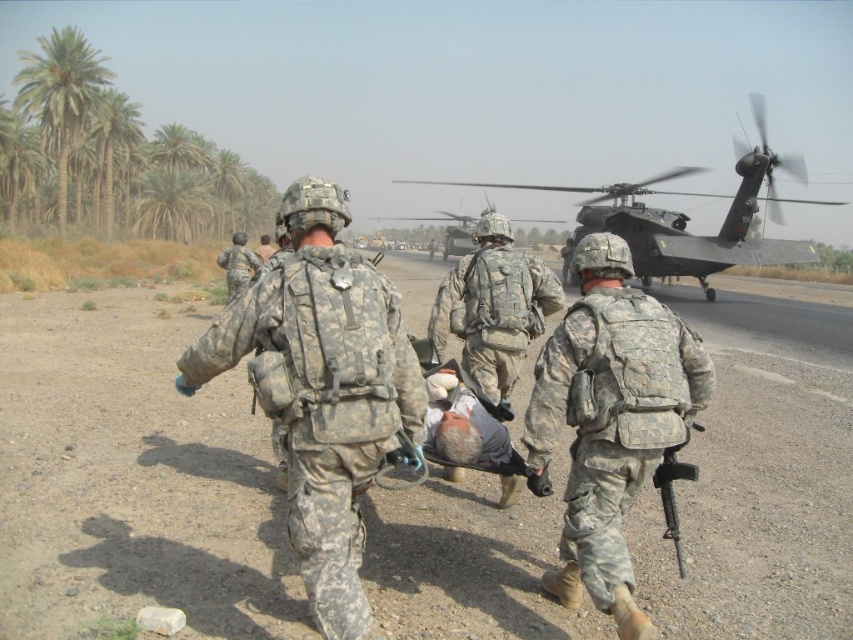
Who is shorter, green leafy palm trees at left or camouflage fabric soldier at center?

With less height is camouflage fabric soldier at center.

Between green leafy palm trees at left and camouflage fabric soldier at center, which one is positioned lower?

camouflage fabric soldier at center is below.

The width and height of the screenshot is (853, 640). What do you see at coordinates (61, 97) in the screenshot?
I see `green leafy palm trees at left` at bounding box center [61, 97].

Where is `green leafy palm trees at left`? green leafy palm trees at left is located at coordinates (61, 97).

Does dark gray matte helicopter at center appear on the left side of camouflage uniform at center?

No, dark gray matte helicopter at center is not to the left of camouflage uniform at center.

Who is positioned more to the right, dark gray matte helicopter at center or camouflage uniform at center?

From the viewer's perspective, dark gray matte helicopter at center appears more on the right side.

The height and width of the screenshot is (640, 853). In order to click on dark gray matte helicopter at center in this screenshot , I will do `click(688, 218)`.

What are the coordinates of `camouflage fabric backpack at center` in the screenshot? It's located at (321, 388).

Is camouflage fabric backpack at center above green leafy palm tree at upper left?

No.

Which is in front, point (395, 365) or point (119, 100)?

Point (395, 365) is in front.

Locate an element on the screen. The width and height of the screenshot is (853, 640). camouflage fabric backpack at center is located at coordinates coord(321,388).